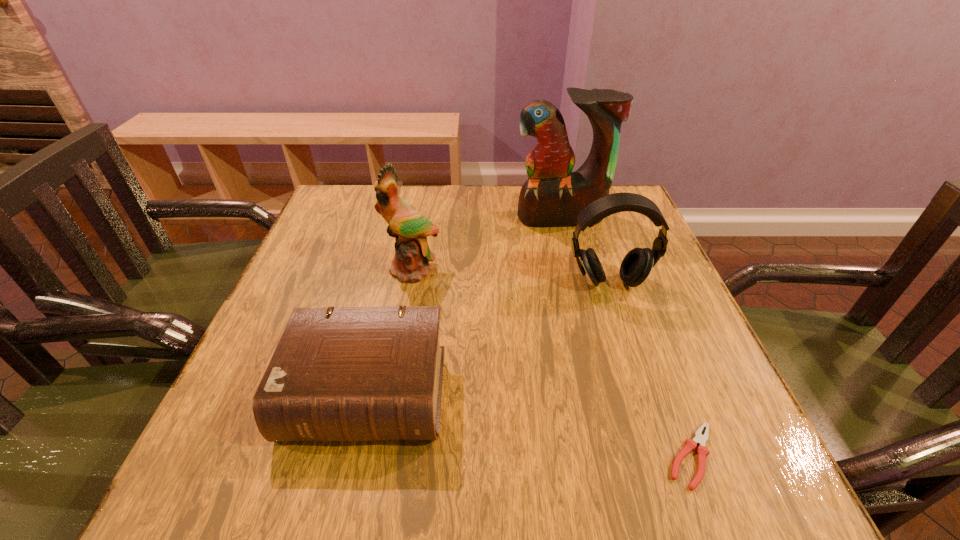
Locate an element on the screen. This screenshot has height=540, width=960. free space in the image that satisfies the following two spatial constraints: 1. on the spine side of the second shortest object; 2. on the right side of the shortest object is located at coordinates (352, 456).

At what (x,y) coordinates should I click in order to perform the action: click on free space that satisfies the following two spatial constraints: 1. on the front-facing side of the nearer parrot; 2. on the left side of the shortest object. Please return your answer as a coordinate pair (x, y). This screenshot has width=960, height=540. Looking at the image, I should click on (378, 456).

Image resolution: width=960 pixels, height=540 pixels. Find the location of `vacant space that satisfies the following two spatial constraints: 1. on the ear cups of the third tallest object; 2. on the right side of the pliers`. vacant space that satisfies the following two spatial constraints: 1. on the ear cups of the third tallest object; 2. on the right side of the pliers is located at coordinates (665, 456).

Locate an element on the screen. free spot that satisfies the following two spatial constraints: 1. on the front-facing side of the shortest object; 2. on the right side of the second tallest object is located at coordinates (378, 456).

Where is `blank space that satisfies the following two spatial constraints: 1. on the front-facing side of the pliers; 2. on the left side of the shorter parrot`? This screenshot has width=960, height=540. blank space that satisfies the following two spatial constraints: 1. on the front-facing side of the pliers; 2. on the left side of the shorter parrot is located at coordinates (378, 456).